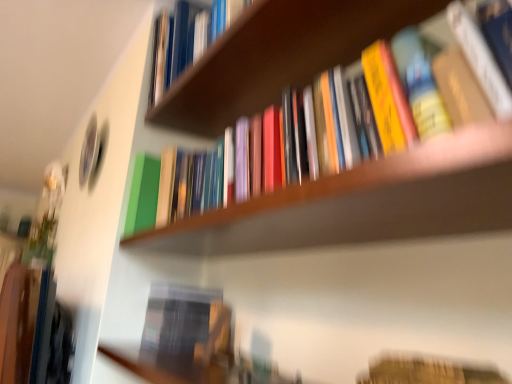
Question: Considering the relative sizes of hardcover book at lower right, acting as the 1th book starting from the bottom, and wooden bookshelf at center in the image provided, is hardcover book at lower right, acting as the 1th book starting from the bottom, bigger than wooden bookshelf at center?

Choices:
 (A) yes
 (B) no

Answer: (B)

Question: Does hardcover book at lower right, the 3th book in the top-to-bottom sequence, have a smaller size compared to wooden bookshelf at center?

Choices:
 (A) yes
 (B) no

Answer: (A)

Question: Is hardcover book at lower right, the 3th book in the top-to-bottom sequence, wider than wooden bookshelf at center?

Choices:
 (A) yes
 (B) no

Answer: (B)

Question: Can you confirm if hardcover book at lower right, acting as the 1th book starting from the bottom, is shorter than wooden bookshelf at center?

Choices:
 (A) yes
 (B) no

Answer: (A)

Question: Is hardcover book at lower right, the 3th book in the top-to-bottom sequence, positioned before wooden bookshelf at center?

Choices:
 (A) yes
 (B) no

Answer: (B)

Question: Is hardcover book at lower right, the 3th book in the top-to-bottom sequence, far from wooden bookshelf at center?

Choices:
 (A) no
 (B) yes

Answer: (A)

Question: Considering the relative positions of wooden bookshelf at upper center and hardcover book at upper center, arranged as the first book when viewed from the top, in the image provided, is wooden bookshelf at upper center to the left of hardcover book at upper center, arranged as the first book when viewed from the top, from the viewer's perspective?

Choices:
 (A) no
 (B) yes

Answer: (A)

Question: Is wooden bookshelf at upper center shorter than hardcover book at upper center, arranged as the first book when viewed from the top?

Choices:
 (A) no
 (B) yes

Answer: (B)

Question: Is wooden bookshelf at upper center thinner than hardcover book at upper center, arranged as the first book when viewed from the top?

Choices:
 (A) yes
 (B) no

Answer: (B)

Question: Would you say wooden bookshelf at upper center is outside hardcover book at upper center, arranged as the first book when viewed from the top?

Choices:
 (A) no
 (B) yes

Answer: (B)

Question: Does wooden bookshelf at upper center contain hardcover book at upper center, the third book in the bottom-to-top sequence?

Choices:
 (A) no
 (B) yes

Answer: (A)

Question: From a real-world perspective, is wooden bookshelf at upper center beneath hardcover book at upper center, the third book in the bottom-to-top sequence?

Choices:
 (A) no
 (B) yes

Answer: (B)

Question: From the image's perspective, is wooden bookshelf at center under wooden bookshelf at upper center?

Choices:
 (A) no
 (B) yes

Answer: (B)